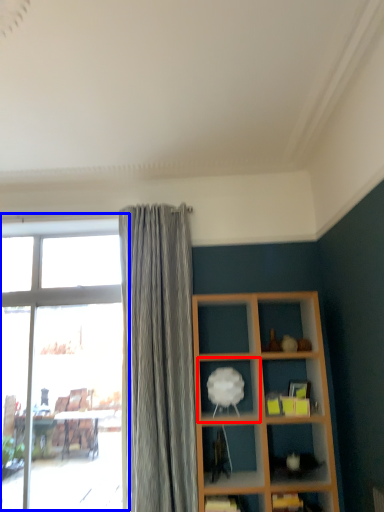
Question: Which of the following is the farthest to the observer, shelf (highlighted by a red box) or window (highlighted by a blue box)?

Choices:
 (A) shelf
 (B) window

Answer: (B)